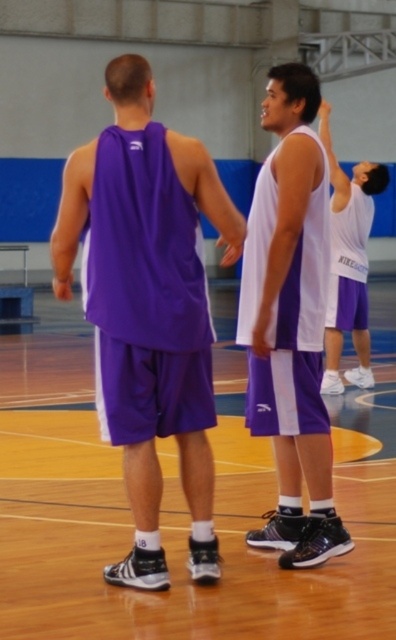
Question: Is purple fabric tank top at center to the left of white matte basketball jersey at upper right from the viewer's perspective?

Choices:
 (A) yes
 (B) no

Answer: (A)

Question: Which object is closer to the camera taking this photo?

Choices:
 (A) white matte basketball jersey at upper right
 (B) white matte tank top at center
 (C) purple fabric tank top at center

Answer: (C)

Question: Can you confirm if purple fabric tank top at center is positioned above white matte basketball jersey at upper right?

Choices:
 (A) yes
 (B) no

Answer: (A)

Question: Is purple fabric tank top at center behind white matte basketball jersey at upper right?

Choices:
 (A) yes
 (B) no

Answer: (B)

Question: Which is nearer to the white matte basketball jersey at upper right?

Choices:
 (A) purple fabric tank top at center
 (B) white matte tank top at center

Answer: (B)

Question: Which object appears farthest from the camera in this image?

Choices:
 (A) white matte tank top at center
 (B) white matte basketball jersey at upper right

Answer: (B)